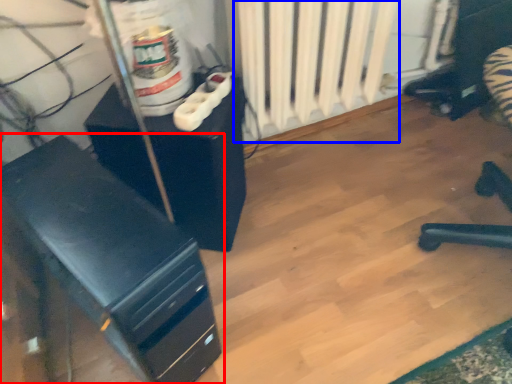
Question: Among these objects, which one is farthest to the camera, furniture (highlighted by a red box) or radiator (highlighted by a blue box)?

Choices:
 (A) furniture
 (B) radiator

Answer: (B)